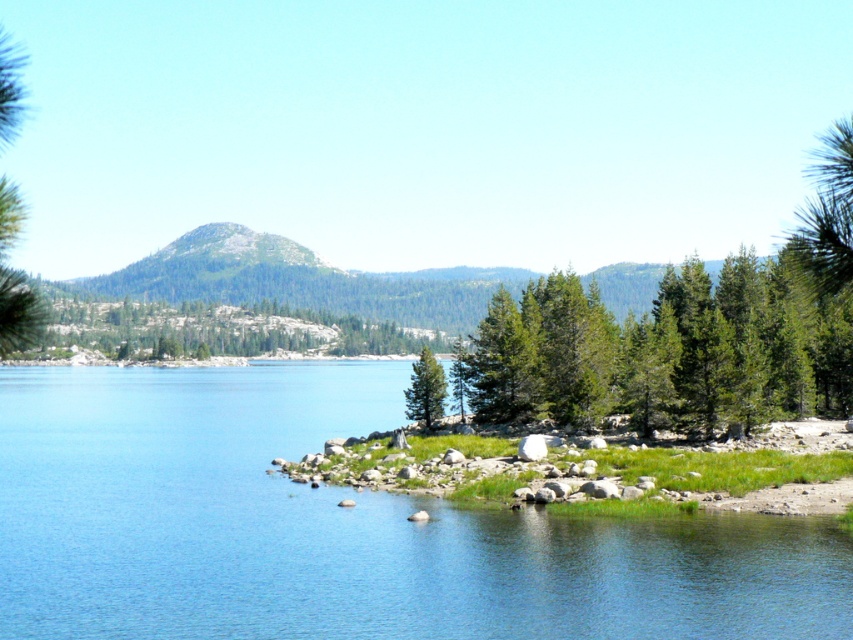
Question: Is green matte tree at center smaller than green textured tree at center?

Choices:
 (A) no
 (B) yes

Answer: (A)

Question: Among these objects, which one is farthest from the camera?

Choices:
 (A) green textured tree at center
 (B) clear blue water at lower center

Answer: (A)

Question: Which of the following is the farthest from the observer?

Choices:
 (A) (502, 285)
 (B) (430, 404)
 (C) (32, 317)

Answer: (A)

Question: Is clear blue water at lower center to the right of green textured pine tree at left from the viewer's perspective?

Choices:
 (A) yes
 (B) no

Answer: (A)

Question: Does clear blue water at lower center appear over green textured pine tree at left?

Choices:
 (A) no
 (B) yes

Answer: (A)

Question: Among these points, which one is nearest to the camera?

Choices:
 (A) 12,182
 (B) 416,397
 (C) 491,326

Answer: (A)